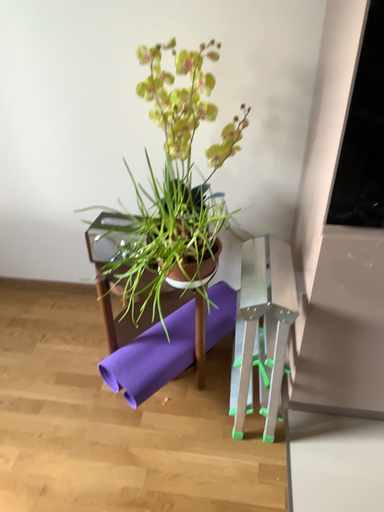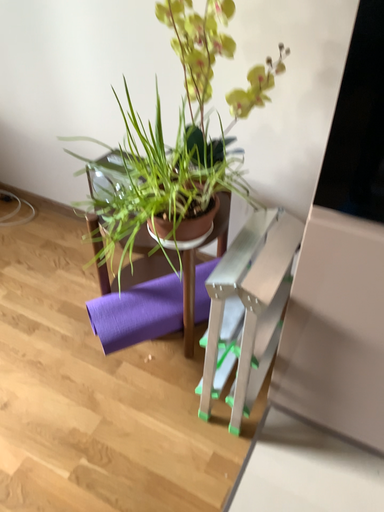
Question: How did the camera likely rotate when shooting the video?

Choices:
 (A) rotated right
 (B) rotated left

Answer: (B)